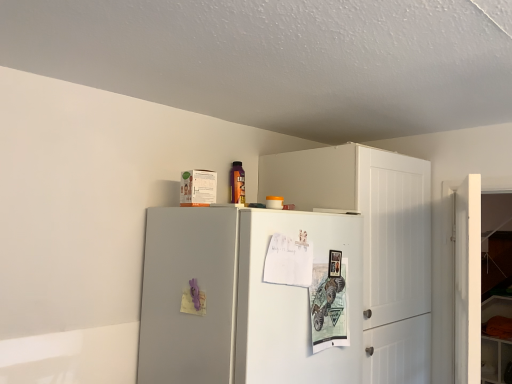
Question: Can you confirm if white matte door at right is bigger than white matte cabinet at upper right?

Choices:
 (A) no
 (B) yes

Answer: (A)

Question: From the image's perspective, is white matte door at right located beneath white matte cabinet at upper right?

Choices:
 (A) yes
 (B) no

Answer: (B)

Question: From a real-world perspective, is white matte door at right on white matte cabinet at upper right?

Choices:
 (A) yes
 (B) no

Answer: (B)

Question: Is white matte door at right outside of white matte cabinet at upper right?

Choices:
 (A) no
 (B) yes

Answer: (B)

Question: From the image's perspective, is white matte door at right on top of white matte cabinet at upper right?

Choices:
 (A) no
 (B) yes

Answer: (B)

Question: Which is correct: white matte door at right is inside white matte cabinet at upper right, or outside of it?

Choices:
 (A) inside
 (B) outside

Answer: (B)

Question: Visually, is white matte door at right positioned to the left or to the right of white matte cabinet at upper right?

Choices:
 (A) left
 (B) right

Answer: (B)

Question: From their relative heights in the image, would you say white matte door at right is taller or shorter than white matte cabinet at upper right?

Choices:
 (A) tall
 (B) short

Answer: (B)

Question: Relative to white matte cabinet at upper right, is white matte door at right in front or behind?

Choices:
 (A) front
 (B) behind

Answer: (A)

Question: Which is correct: satin gray refrigerator at upper center is inside white matte cabinet at upper right, or outside of it?

Choices:
 (A) inside
 (B) outside

Answer: (B)

Question: Looking at their shapes, would you say satin gray refrigerator at upper center is wider or thinner than white matte cabinet at upper right?

Choices:
 (A) thin
 (B) wide

Answer: (B)

Question: Looking at the image, does satin gray refrigerator at upper center seem bigger or smaller compared to white matte cabinet at upper right?

Choices:
 (A) big
 (B) small

Answer: (B)

Question: From the image's perspective, is satin gray refrigerator at upper center above or below white matte cabinet at upper right?

Choices:
 (A) above
 (B) below

Answer: (B)

Question: In terms of size, does satin gray refrigerator at upper center appear bigger or smaller than white matte door at right?

Choices:
 (A) big
 (B) small

Answer: (A)

Question: Is satin gray refrigerator at upper center wider or thinner than white matte door at right?

Choices:
 (A) thin
 (B) wide

Answer: (B)